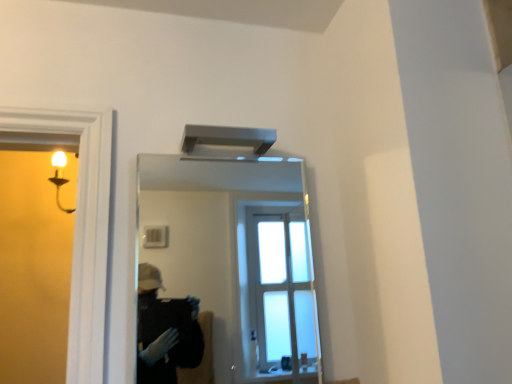
Question: Considering the positions of clear glass mirror at upper center and satin silver exhaust hood at upper center in the image, is clear glass mirror at upper center wider or thinner than satin silver exhaust hood at upper center?

Choices:
 (A) thin
 (B) wide

Answer: (A)

Question: Would you say clear glass mirror at upper center is inside or outside satin silver exhaust hood at upper center?

Choices:
 (A) outside
 (B) inside

Answer: (A)

Question: Considering the positions of clear glass mirror at upper center and satin silver exhaust hood at upper center in the image, is clear glass mirror at upper center taller or shorter than satin silver exhaust hood at upper center?

Choices:
 (A) tall
 (B) short

Answer: (A)

Question: Considering the relative positions of satin silver exhaust hood at upper center and clear glass mirror at upper center in the image provided, is satin silver exhaust hood at upper center to the left or to the right of clear glass mirror at upper center?

Choices:
 (A) right
 (B) left

Answer: (B)

Question: Considering the positions of satin silver exhaust hood at upper center and clear glass mirror at upper center in the image, is satin silver exhaust hood at upper center taller or shorter than clear glass mirror at upper center?

Choices:
 (A) short
 (B) tall

Answer: (A)

Question: In terms of size, does satin silver exhaust hood at upper center appear bigger or smaller than clear glass mirror at upper center?

Choices:
 (A) big
 (B) small

Answer: (B)

Question: Is satin silver exhaust hood at upper center inside or outside of clear glass mirror at upper center?

Choices:
 (A) inside
 (B) outside

Answer: (B)